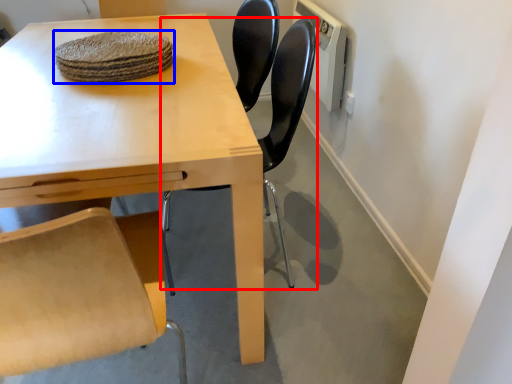
Question: Which object appears farthest to the camera in this image, chair (highlighted by a red box) or food (highlighted by a blue box)?

Choices:
 (A) chair
 (B) food

Answer: (B)